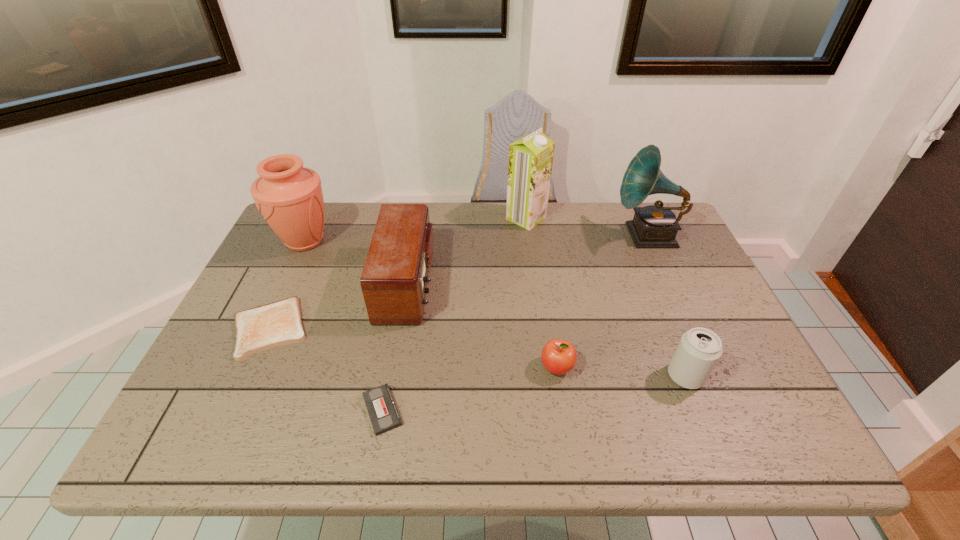
Identify the location of soya milk. 531,157.

In order to click on phonograph_record in this screenshot , I will do `click(654, 226)`.

Locate an element on the screen. This screenshot has height=540, width=960. vase is located at coordinates (289, 196).

This screenshot has width=960, height=540. In order to click on the fourth tallest object in this screenshot , I will do `click(394, 279)`.

Where is `the fourth shortest object`? This screenshot has height=540, width=960. the fourth shortest object is located at coordinates (699, 349).

At what (x,y) coordinates should I click in order to perform the action: click on the sixth tallest object. Please return your answer as a coordinate pair (x, y). The width and height of the screenshot is (960, 540). Looking at the image, I should click on [x=559, y=356].

In order to click on toast in this screenshot , I will do `click(278, 323)`.

Identify the location of videotape. Image resolution: width=960 pixels, height=540 pixels. coord(384,416).

Locate an element on the screen. The image size is (960, 540). vacant space located 0.090m on the right of the soya milk is located at coordinates (574, 218).

The width and height of the screenshot is (960, 540). I want to click on vacant region located from the horn of the phonograph_record, so click(483, 235).